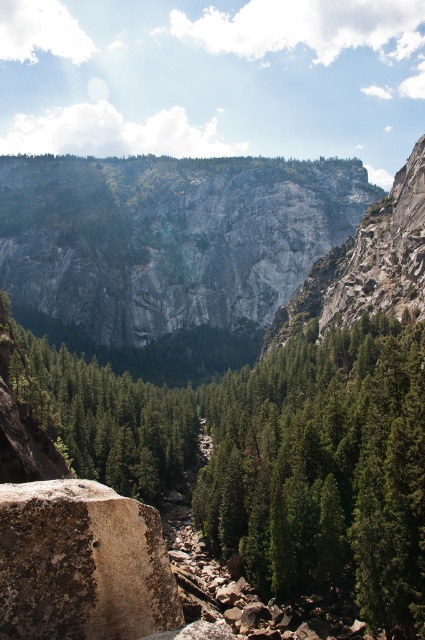
Can you confirm if gray rock cliff at center is bigger than rusty brown rock at lower left?

Correct, gray rock cliff at center is larger in size than rusty brown rock at lower left.

Consider the image. Is gray rock cliff at center to the right of rusty brown rock at lower left from the viewer's perspective?

Incorrect, gray rock cliff at center is not on the right side of rusty brown rock at lower left.

Who is more distant from viewer, (118, 211) or (133, 608)?

The point (118, 211) is more distant.

Identify the location of gray rock cliff at center. (169, 236).

Is green matte tree at center bigger than rusty brown rock at lower left?

Indeed, green matte tree at center has a larger size compared to rusty brown rock at lower left.

Between green matte tree at center and rusty brown rock at lower left, which one appears on the left side from the viewer's perspective?

Positioned to the left is rusty brown rock at lower left.

Does point (209, 490) lie behind point (62, 580)?

Yes.

Find the location of a particular element. green matte tree at center is located at coordinates (269, 456).

You are a GUI agent. You are given a task and a screenshot of the screen. Output one action in this format:
    pyautogui.click(x=<x>, y=<y>)
    Task: Click on the green matte tree at center
    This screenshot has width=425, height=640.
    Given the screenshot: What is the action you would take?
    pyautogui.click(x=269, y=456)

Who is positioned more to the right, green matte tree at center or gray rock cliff at center?

From the viewer's perspective, green matte tree at center appears more on the right side.

Measure the distance between green matte tree at center and camera.

A distance of 42.51 meters exists between green matte tree at center and camera.

Locate an element on the screen. green matte tree at center is located at coordinates (269, 456).